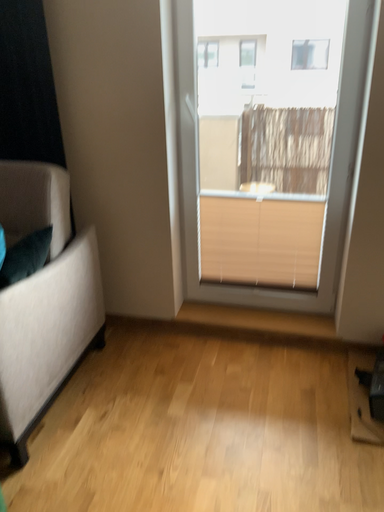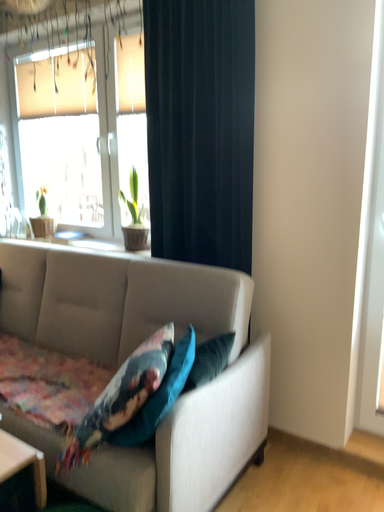
Question: How did the camera likely rotate when shooting the video?

Choices:
 (A) rotated upward
 (B) rotated downward

Answer: (A)